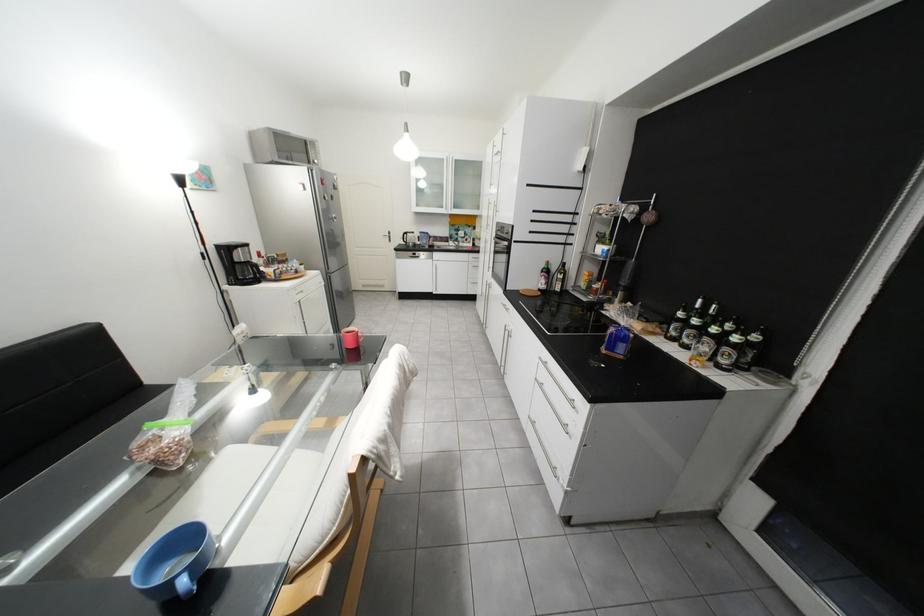
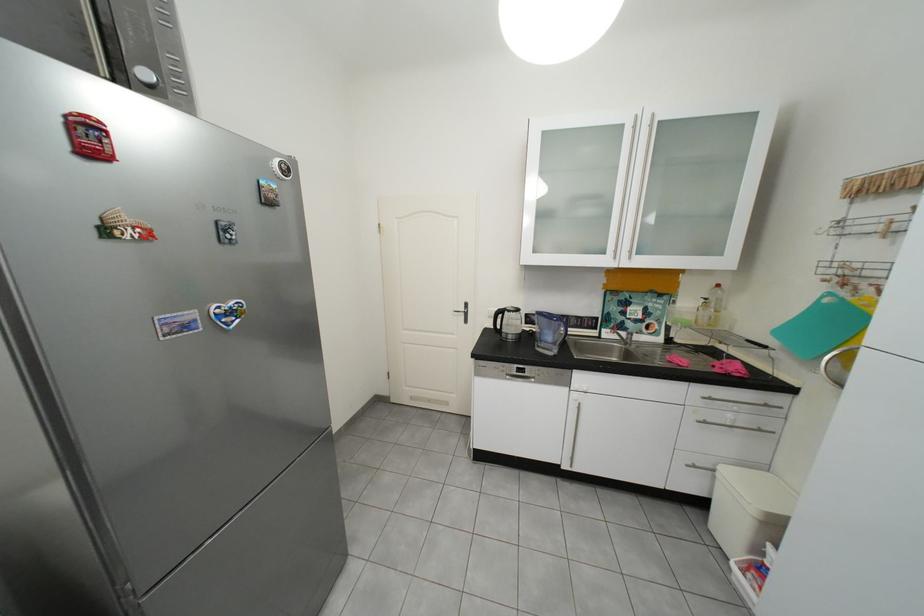
Find the pixel in the second image that matches point 463,244 in the first image.

(619, 334)